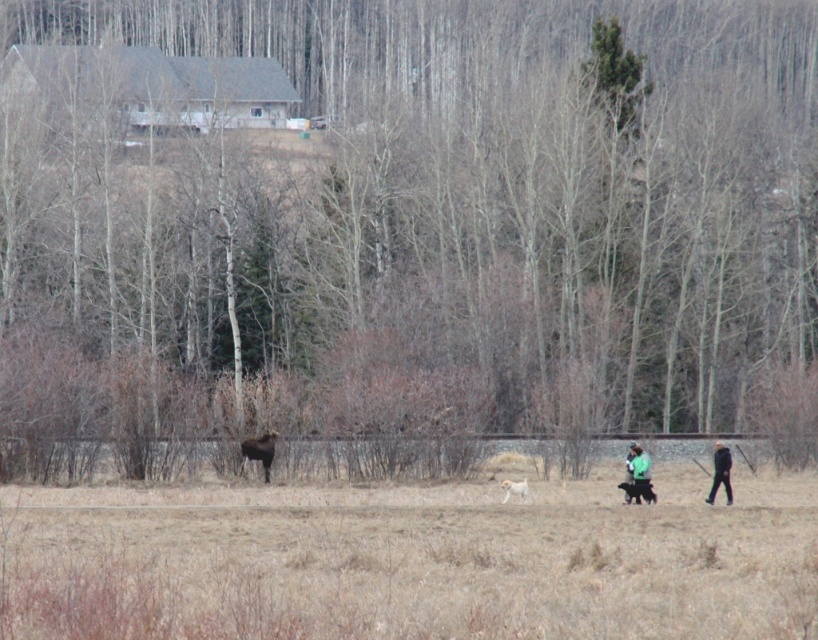
Question: Among these points, which one is nearest to the camera?

Choices:
 (A) (405, 602)
 (B) (715, 492)
 (C) (245, 442)
 (D) (654, 497)

Answer: (A)

Question: Does brown textured tree at lower center appear on the left side of light brown fur dog at center?

Choices:
 (A) yes
 (B) no

Answer: (B)

Question: Which of the following is the farthest from the observer?

Choices:
 (A) (385, 88)
 (B) (511, 486)
 (C) (645, 486)

Answer: (A)

Question: In this image, where is brown grass at center located relative to brown furry moose at center?

Choices:
 (A) below
 (B) above

Answer: (A)

Question: Does brown textured tree at lower center have a lesser width compared to brown grass at center?

Choices:
 (A) no
 (B) yes

Answer: (A)

Question: Which of the following is the closest to the observer?

Choices:
 (A) brown grass at center
 (B) brown textured tree at lower center

Answer: (A)